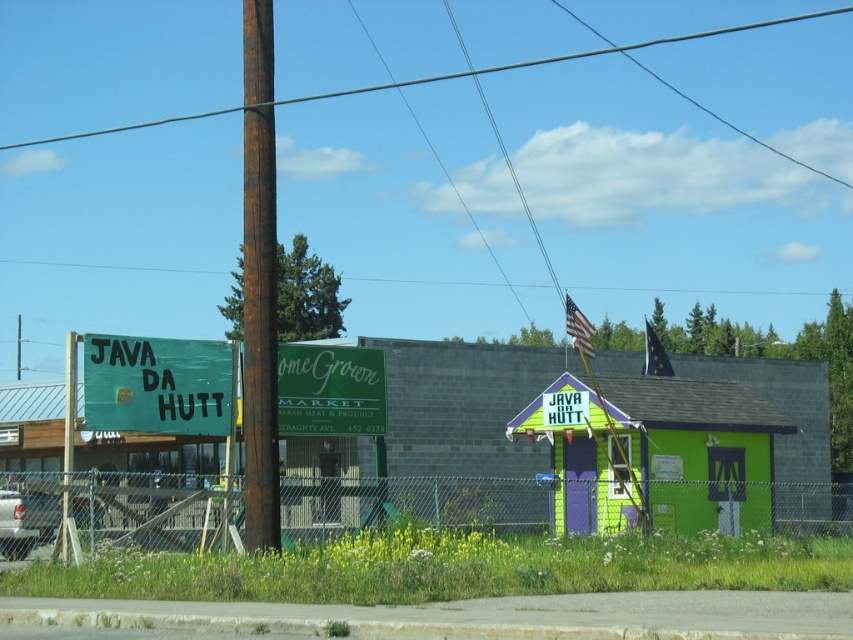
Question: Among these points, which one is farthest from the camera?

Choices:
 (A) (125, 125)
 (B) (245, 406)
 (C) (311, 356)
 (D) (788, 512)

Answer: (A)

Question: Is metal chain-link fence at lower center to the left of brown wooden pole at upper center from the viewer's perspective?

Choices:
 (A) yes
 (B) no

Answer: (B)

Question: Does rusty wood pole at center lie in front of brown wooden pole at upper center?

Choices:
 (A) no
 (B) yes

Answer: (B)

Question: Is the position of metal chain-link fence at lower center less distant than that of green matte sign at center?

Choices:
 (A) no
 (B) yes

Answer: (B)

Question: Which of these objects is positioned closest to the brown wooden pole at upper center?

Choices:
 (A) metal chain-link fence at lower center
 (B) rusty wood pole at center

Answer: (A)

Question: Which object appears farthest from the camera in this image?

Choices:
 (A) green matte signboard at left
 (B) green matte sign at center

Answer: (B)